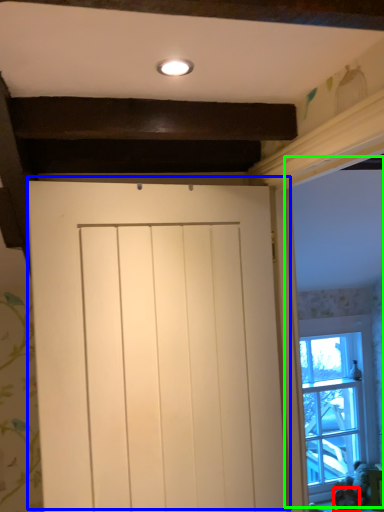
Question: Which object is the farthest from animal (highlighted by a red box)? Choose among these: door (highlighted by a blue box) or window frame (highlighted by a green box).

Choices:
 (A) door
 (B) window frame

Answer: (A)